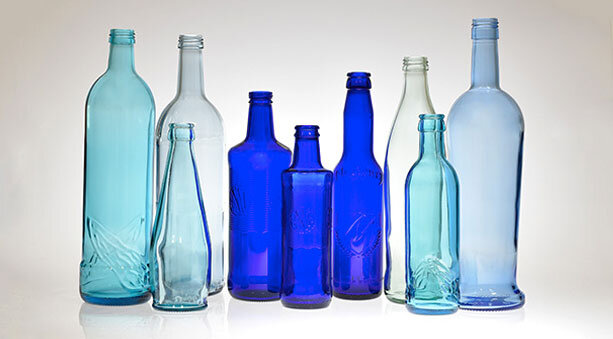
Find the location of a particular element. glass bottle is located at coordinates (485, 131), (427, 249), (416, 96), (341, 222), (295, 233), (260, 218), (189, 101), (175, 256), (127, 239).